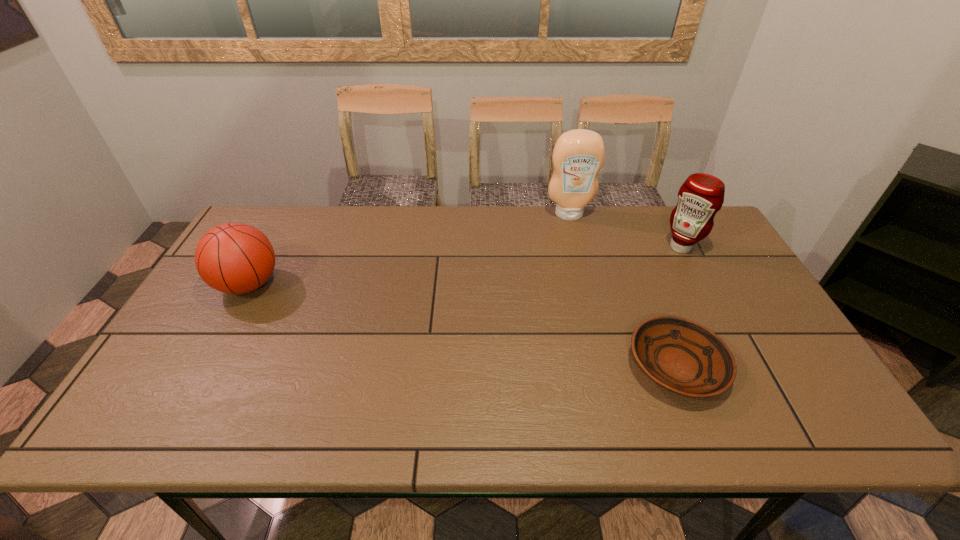
Where is `blank area located 0.100m on the front of the second nearest object`? blank area located 0.100m on the front of the second nearest object is located at coordinates (219, 339).

You are a GUI agent. You are given a task and a screenshot of the screen. Output one action in this format:
    pyautogui.click(x=<x>, y=<y>)
    Task: Click on the vacant region located on the back of the shortest object
    
    Given the screenshot: What is the action you would take?
    pyautogui.click(x=629, y=244)

This screenshot has height=540, width=960. Identify the location of object present at the near edge. (680, 355).

Image resolution: width=960 pixels, height=540 pixels. What are the coordinates of `object that is at the left edge` in the screenshot? It's located at (234, 258).

Identify the location of object that is at the right edge. (701, 196).

The image size is (960, 540). I want to click on object that is at the far right corner, so click(x=701, y=196).

In the image, there is a desktop. Identify the location of vacant space at the far edge. (373, 216).

Identify the location of free space at the near edge of the desktop. (382, 408).

At what (x,y) coordinates should I click in order to perform the action: click on vacant point at the left edge. Please return your answer as a coordinate pair (x, y). Looking at the image, I should click on (219, 308).

Locate an element on the screen. vacant area that lies between the nearest object and the tallest object is located at coordinates tap(623, 290).